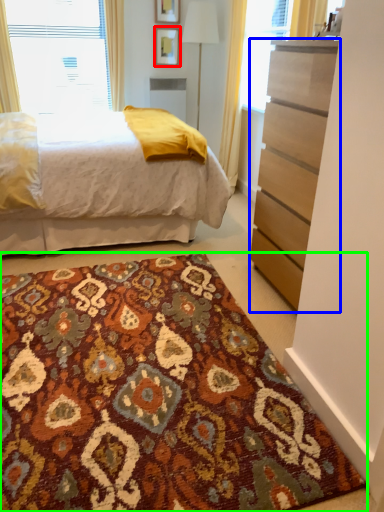
Question: Based on their relative distances, which object is nearer to picture frame (highlighted by a red box)? Choose from chest of drawers (highlighted by a blue box) and doormat (highlighted by a green box).

Choices:
 (A) chest of drawers
 (B) doormat

Answer: (A)